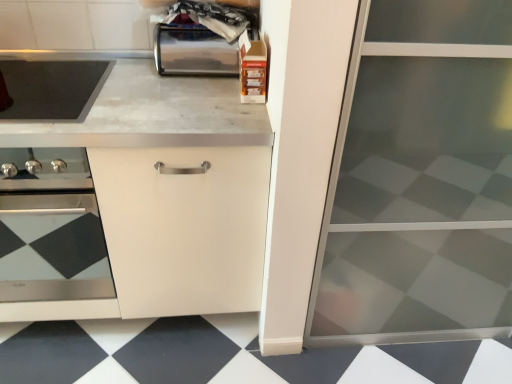
Question: Considering the positions of point [165, 72] and point [64, 97], is point [165, 72] closer or farther from the camera than point [64, 97]?

Choices:
 (A) farther
 (B) closer

Answer: (B)

Question: Considering the positions of shiny metallic toaster at upper center and smooth black cooktop at upper left in the image, is shiny metallic toaster at upper center bigger or smaller than smooth black cooktop at upper left?

Choices:
 (A) small
 (B) big

Answer: (B)

Question: Which object is positioned closest to the white marble countertop at center?

Choices:
 (A) transparent glass screen door at right
 (B) black glossy tile at lower center
 (C) smooth black cooktop at upper left
 (D) matte black oven at left
 (E) shiny metallic toaster at upper center

Answer: (C)

Question: Which is farther from the white marble countertop at center?

Choices:
 (A) transparent glass screen door at right
 (B) matte black oven at left
 (C) black glossy tile at lower center
 (D) shiny metallic toaster at upper center
 (E) smooth black cooktop at upper left

Answer: (C)